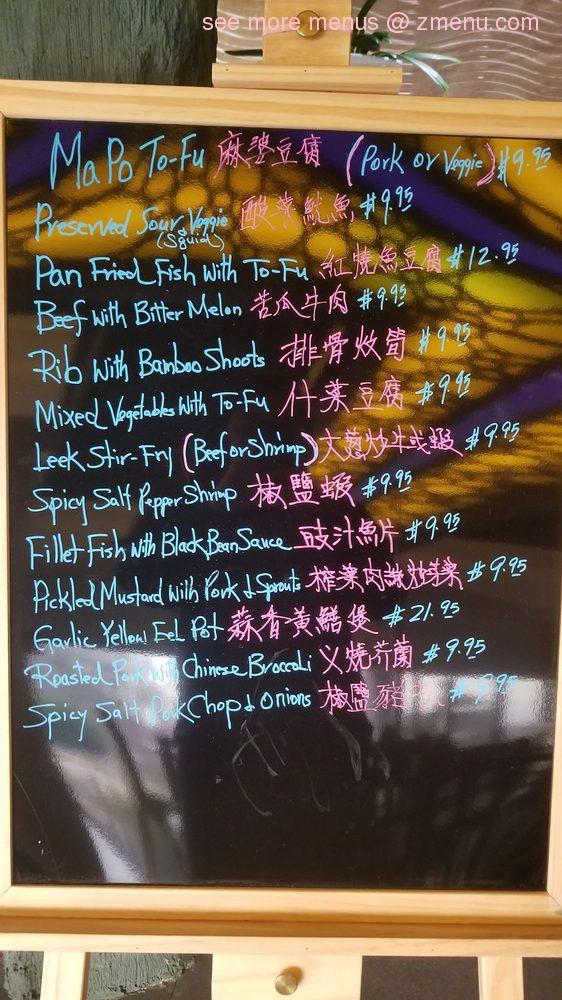
This screenshot has height=1000, width=562. Find the location of `knob handle`. knob handle is located at coordinates (285, 982), (306, 29).